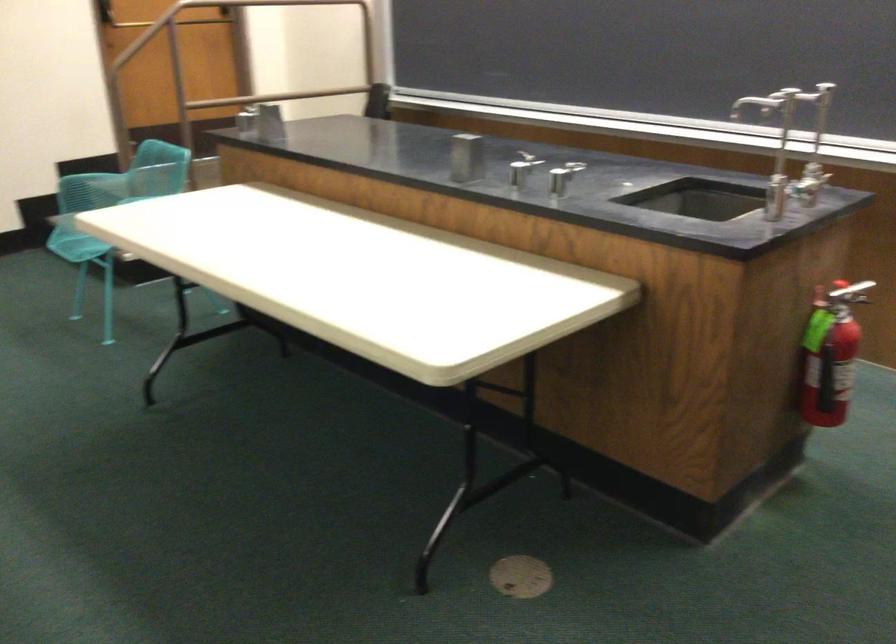
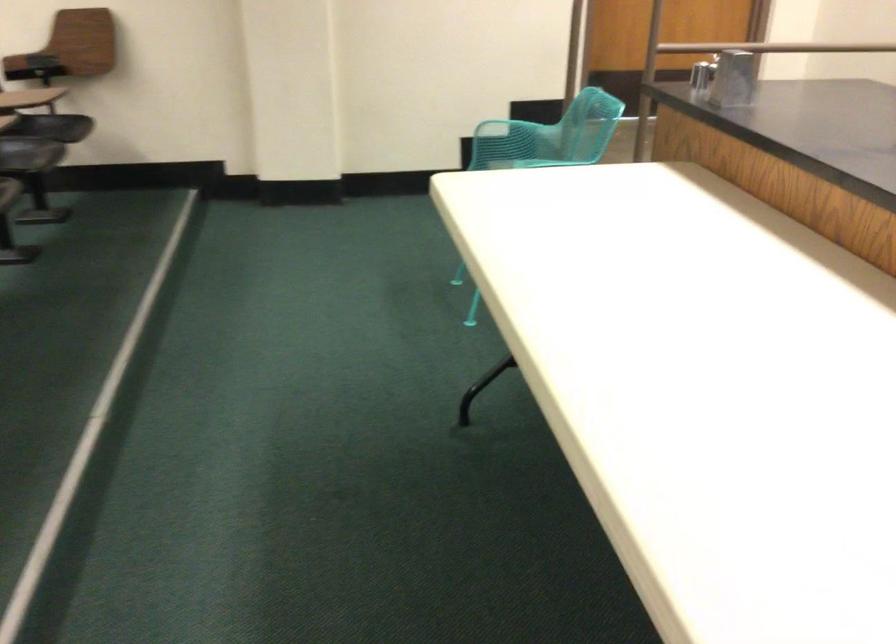
Find the pixel in the second image that matches (81,204) in the first image.

(489, 158)